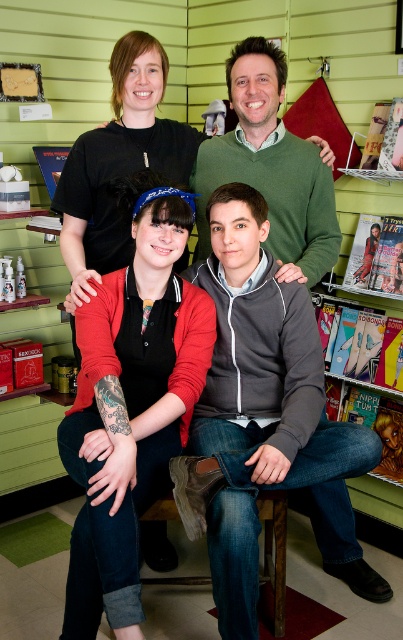
Can you confirm if red matte cardigan at center is shorter than green wool sweater at upper center?

Incorrect, red matte cardigan at center's height does not fall short of green wool sweater at upper center's.

Is red matte cardigan at center behind green wool sweater at upper center?

No, it is in front of green wool sweater at upper center.

Image resolution: width=403 pixels, height=640 pixels. What are the coordinates of `red matte cardigan at center` in the screenshot? It's located at (130, 403).

Who is more forward, (263, 348) or (307, 209)?

Point (263, 348) is more forward.

Is gray zip-up hoodie at center taller than green wool sweater at upper center?

Yes.

Where is `gray zip-up hoodie at center`? gray zip-up hoodie at center is located at coordinates (268, 416).

Where is `gray zip-up hoodie at center`? gray zip-up hoodie at center is located at coordinates (268, 416).

Who is more forward, (267, 296) or (184, 408)?

Point (184, 408) is more forward.

The image size is (403, 640). What are the coordinates of `gray zip-up hoodie at center` in the screenshot? It's located at (268, 416).

I want to click on gray zip-up hoodie at center, so click(268, 416).